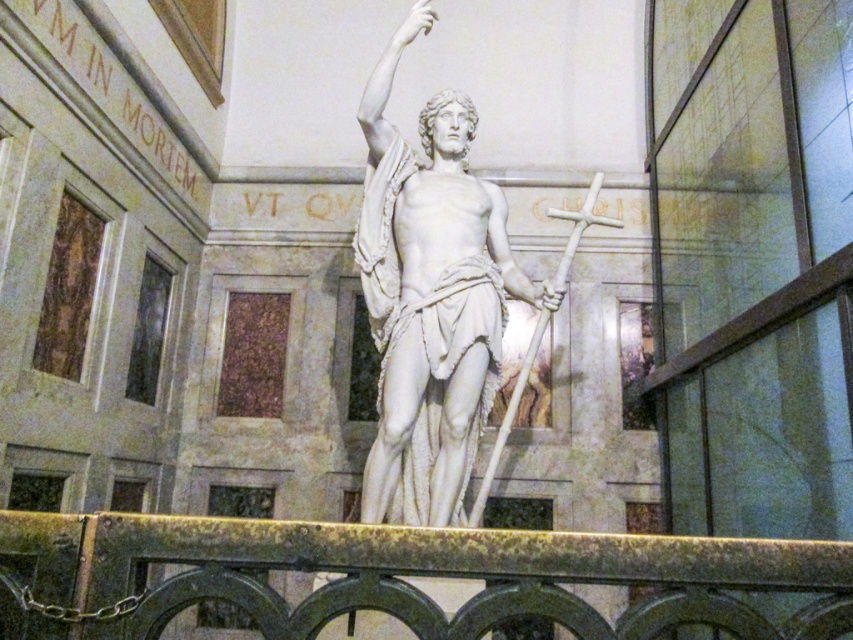
Question: Can you confirm if rusty metal railing at lower center is smaller than white marble statue at center?

Choices:
 (A) no
 (B) yes

Answer: (B)

Question: Among these points, which one is farthest from the camera?

Choices:
 (A) (761, 541)
 (B) (421, 417)

Answer: (B)

Question: Among these objects, which one is nearest to the camera?

Choices:
 (A) white marble statue at center
 (B) rusty metal railing at lower center

Answer: (B)

Question: Can you confirm if rusty metal railing at lower center is thinner than white marble statue at center?

Choices:
 (A) yes
 (B) no

Answer: (B)

Question: Is rusty metal railing at lower center bigger than white marble statue at center?

Choices:
 (A) yes
 (B) no

Answer: (B)